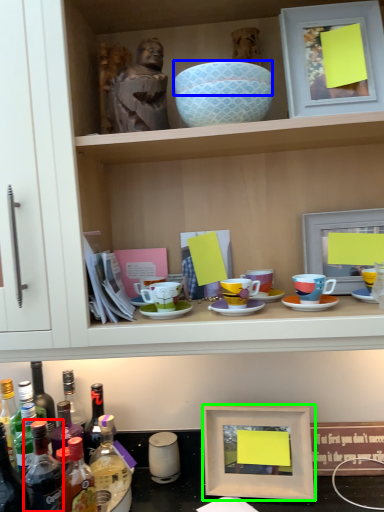
Question: Considering the real-world distances, which object is closest to bottle (highlighted by a red box)? bowl (highlighted by a blue box) or picture frame (highlighted by a green box).

Choices:
 (A) bowl
 (B) picture frame

Answer: (B)